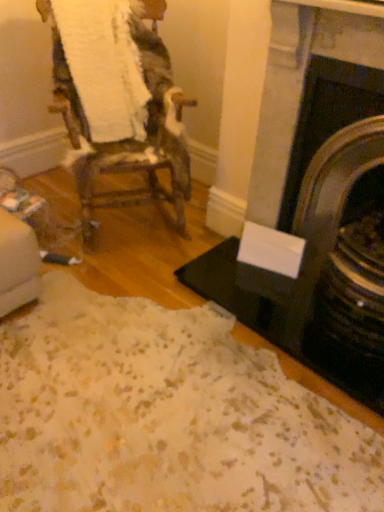
Question: Is dark gray stone fireplace at right positioned far away from woodenchair at left?

Choices:
 (A) no
 (B) yes

Answer: (A)

Question: Can you confirm if dark gray stone fireplace at right is bigger than woodenchair at left?

Choices:
 (A) no
 (B) yes

Answer: (A)

Question: Does dark gray stone fireplace at right lie in front of woodenchair at left?

Choices:
 (A) yes
 (B) no

Answer: (A)

Question: Does dark gray stone fireplace at right turn towards woodenchair at left?

Choices:
 (A) yes
 (B) no

Answer: (B)

Question: From the image's perspective, is dark gray stone fireplace at right under woodenchair at left?

Choices:
 (A) yes
 (B) no

Answer: (A)

Question: Is woodenchair at left completely or partially inside dark gray stone fireplace at right?

Choices:
 (A) no
 (B) yes

Answer: (A)

Question: Is woodenchair at left next to dark gray stone fireplace at right?

Choices:
 (A) no
 (B) yes

Answer: (A)

Question: Does woodenchair at left have a greater width compared to dark gray stone fireplace at right?

Choices:
 (A) no
 (B) yes

Answer: (B)

Question: Is woodenchair at left far away from dark gray stone fireplace at right?

Choices:
 (A) no
 (B) yes

Answer: (A)

Question: Can dark gray stone fireplace at right be found inside woodenchair at left?

Choices:
 (A) no
 (B) yes

Answer: (A)

Question: Is woodenchair at left smaller than dark gray stone fireplace at right?

Choices:
 (A) yes
 (B) no

Answer: (B)

Question: Is woodenchair at left thinner than dark gray stone fireplace at right?

Choices:
 (A) yes
 (B) no

Answer: (B)

Question: Is dark gray stone fireplace at right taller or shorter than woodenchair at left?

Choices:
 (A) short
 (B) tall

Answer: (B)